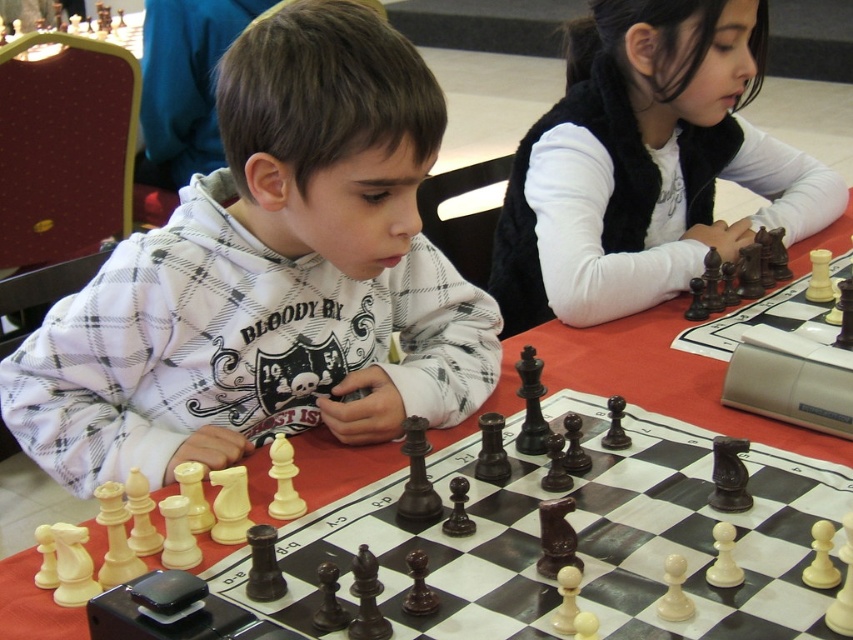
You are a photographer trying to capture a closeup of the white fleece hoodie at center and the white fleece vest at upper right. Which one is positioned lower in the frame?

The white fleece hoodie at center is positioned lower in the frame than the white fleece vest at upper right.